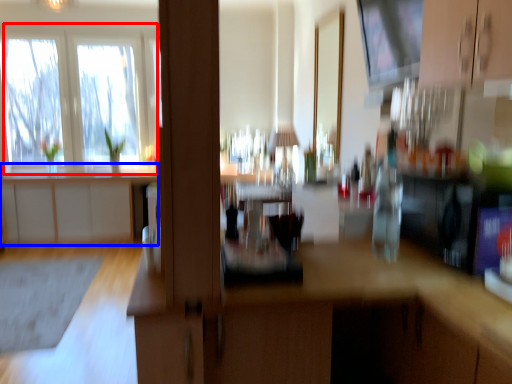
Question: Which point is further to the camera, window (highlighted by a red box) or cabinetry (highlighted by a blue box)?

Choices:
 (A) window
 (B) cabinetry

Answer: (A)